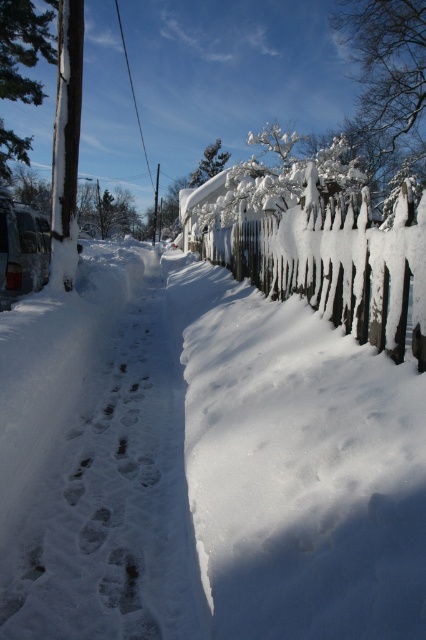
Question: Is white snow at center smaller than snow-covered wooden fence at right?

Choices:
 (A) no
 (B) yes

Answer: (B)

Question: Is white snow at center smaller than snow-covered wooden fence at right?

Choices:
 (A) yes
 (B) no

Answer: (A)

Question: Which point is farther to the camera?

Choices:
 (A) snow-covered wooden fence at right
 (B) white snow at center

Answer: (A)

Question: Is white snow at center bigger than snow-covered wooden fence at right?

Choices:
 (A) no
 (B) yes

Answer: (A)

Question: Which of the following is the farthest from the observer?

Choices:
 (A) (371, 285)
 (B) (11, 634)

Answer: (A)

Question: Which point is closer to the camera?

Choices:
 (A) (83, 456)
 (B) (425, 221)

Answer: (B)